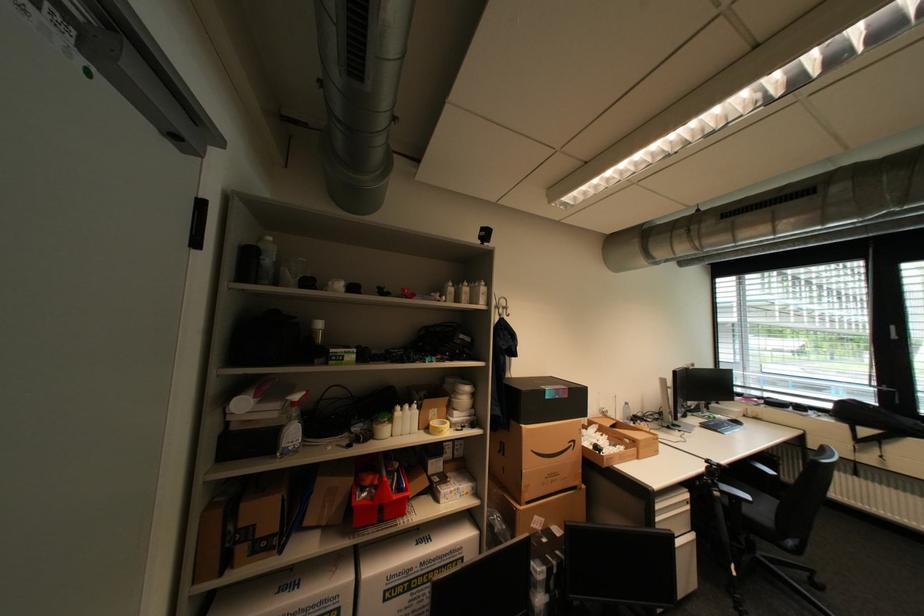
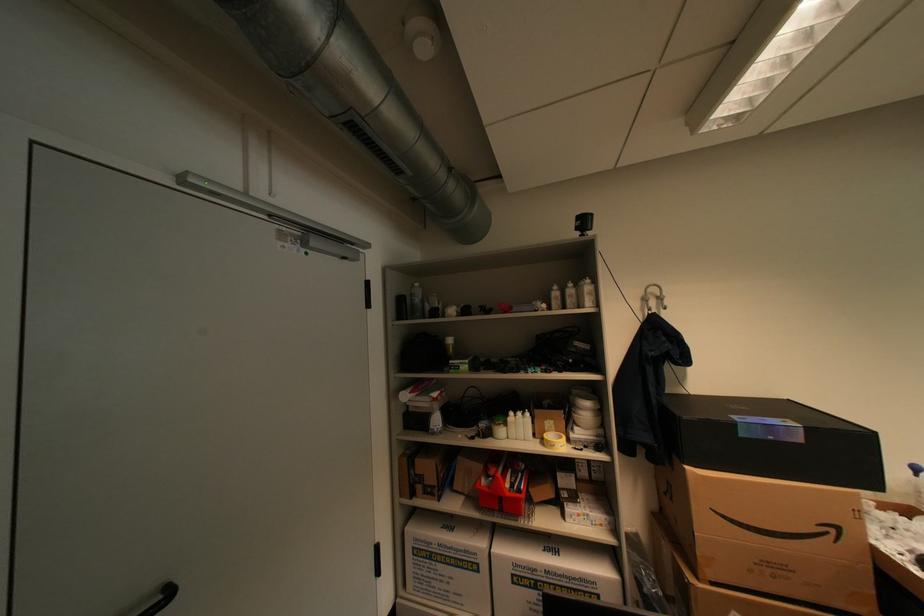
Locate, in the second image, the point that corresponds to the point at 402,498 in the first image.

(516, 495)